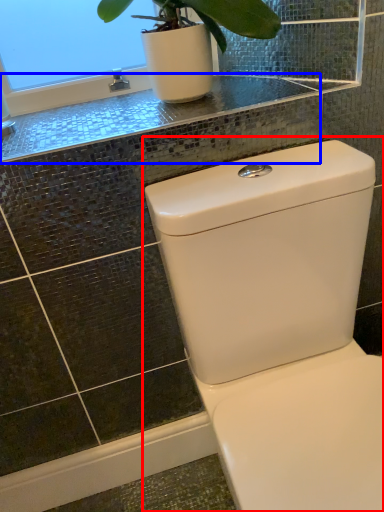
Question: Which object is closer to the camera taking this photo, toilet (highlighted by a red box) or counter top (highlighted by a blue box)?

Choices:
 (A) toilet
 (B) counter top

Answer: (A)